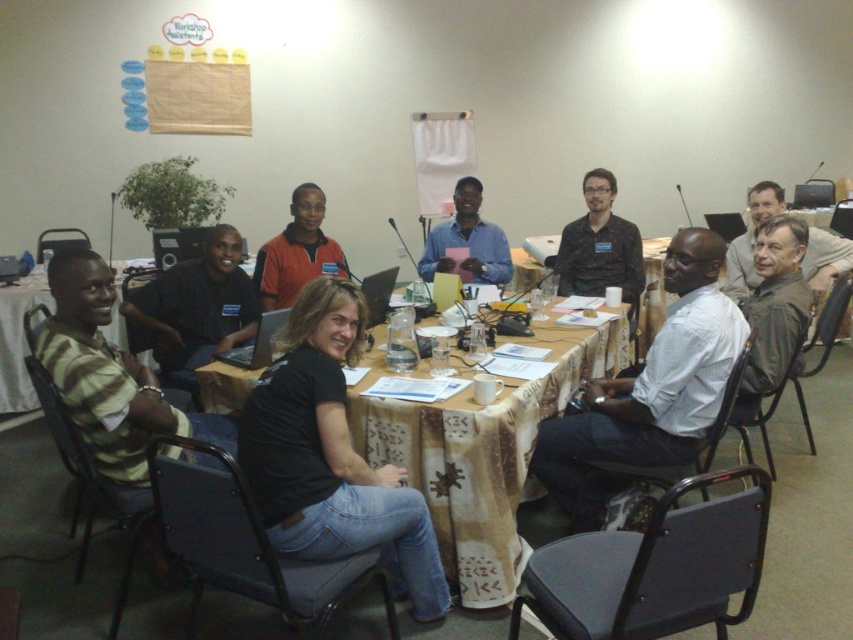
Who is more distant from viewer, (630, 380) or (453, 202)?

The point (453, 202) is more distant.

Is white shirt at center thinner than blue shirt at center?

In fact, white shirt at center might be wider than blue shirt at center.

This screenshot has height=640, width=853. Find the location of `white shirt at center`. white shirt at center is located at coordinates tap(648, 388).

Can you confirm if white shirt at center is positioned above gray fabric shirt at upper right?

Incorrect, white shirt at center is not positioned above gray fabric shirt at upper right.

Does point (556, 481) come farther from viewer compared to point (738, 280)?

No, it is in front of (738, 280).

What do you see at coordinates (648, 388) in the screenshot?
I see `white shirt at center` at bounding box center [648, 388].

Image resolution: width=853 pixels, height=640 pixels. I want to click on white shirt at center, so click(x=648, y=388).

Is matte black shirt at center taller than blue shirt at center?

Correct, matte black shirt at center is much taller as blue shirt at center.

Which is above, matte black shirt at center or blue shirt at center?

Positioned higher is blue shirt at center.

Does point (190, 371) lie in front of point (480, 260)?

That is True.

This screenshot has height=640, width=853. Find the location of `matte black shirt at center`. matte black shirt at center is located at coordinates (195, 308).